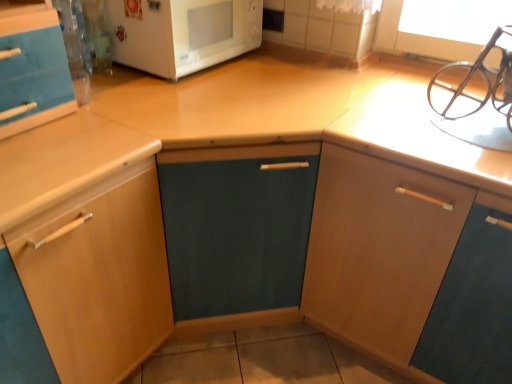
You are a GUI agent. You are given a task and a screenshot of the screen. Output one action in this format:
    pyautogui.click(x=<x>, y=<y>)
    Task: Click on the vacant space that is to the left of metallic silver sink at upper right
    This screenshot has width=512, height=384.
    Given the screenshot: What is the action you would take?
    pyautogui.click(x=398, y=113)